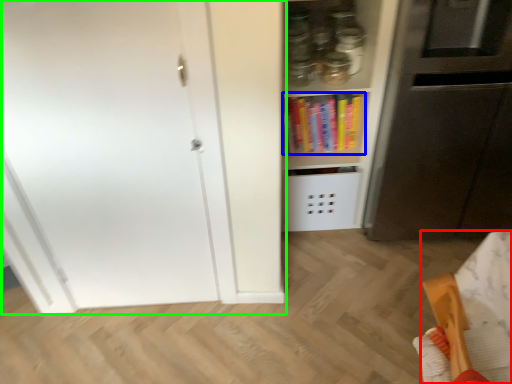
Question: Estimate the real-world distances between objects in this image. Which object is farther from furniture (highlighted by a red box), book (highlighted by a blue box) or door (highlighted by a green box)?

Choices:
 (A) book
 (B) door

Answer: (A)